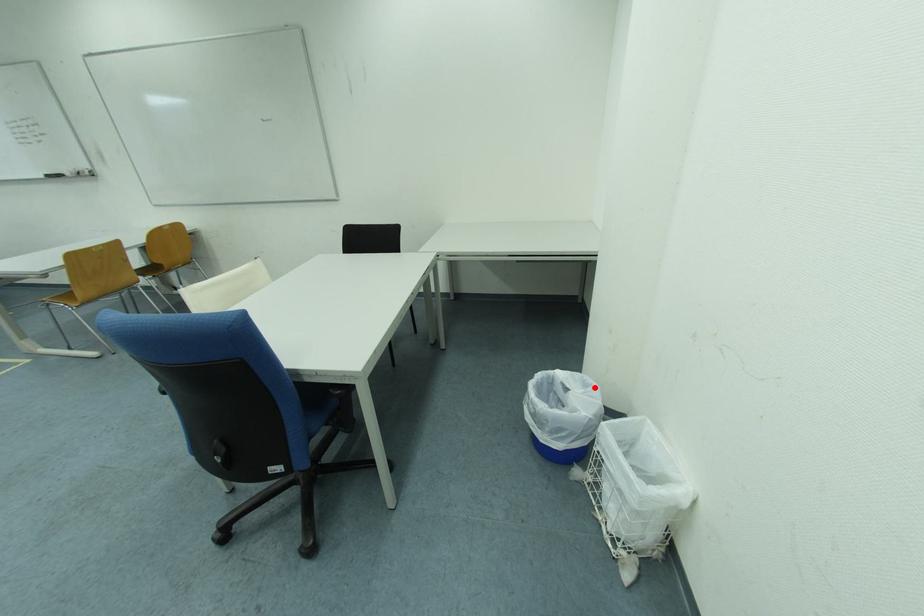
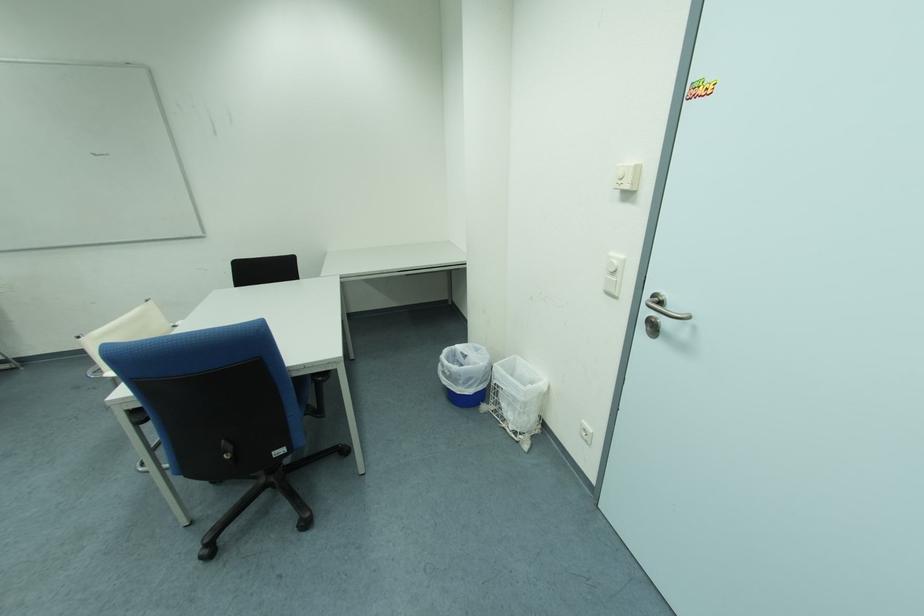
Locate, in the second image, the point that corresponds to the highlighted location in the first image.

(485, 352)